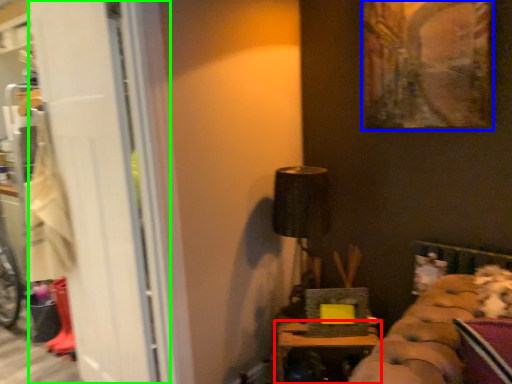
Question: Which is farther away from furniture (highlighted by a red box)? picture frame (highlighted by a blue box) or screen door (highlighted by a green box)?

Choices:
 (A) picture frame
 (B) screen door

Answer: (A)